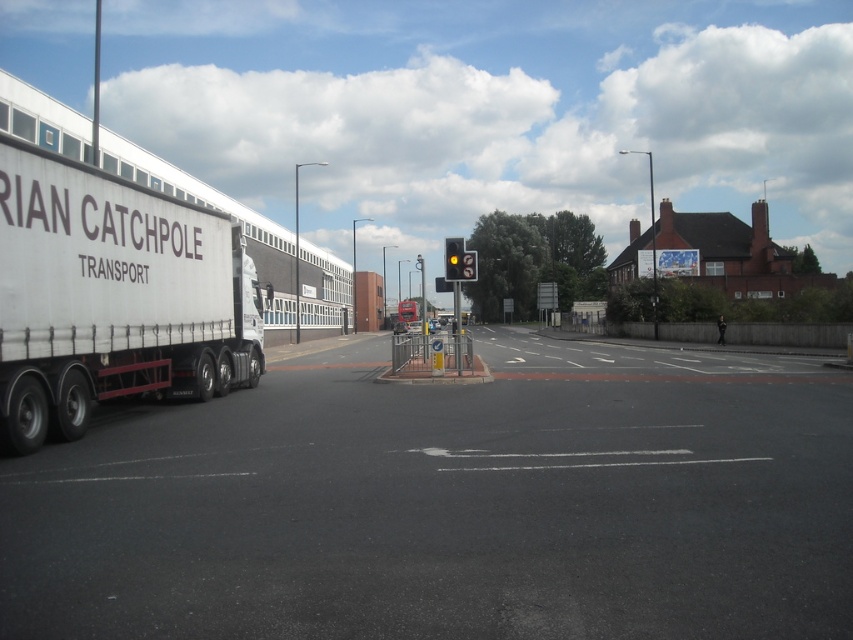
Question: Which point is farther from the camera taking this photo?

Choices:
 (A) (109, 218)
 (B) (445, 248)

Answer: (B)

Question: Does white matte trailer truck at left have a smaller size compared to yellow matte traffic light at center?

Choices:
 (A) no
 (B) yes

Answer: (A)

Question: Is white matte trailer truck at left thinner than yellow matte traffic light at center?

Choices:
 (A) yes
 (B) no

Answer: (B)

Question: Does white matte trailer truck at left appear over yellow matte traffic light at center?

Choices:
 (A) no
 (B) yes

Answer: (A)